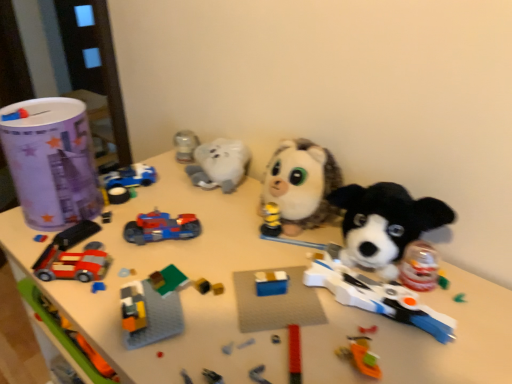
What are the coordinates of `free location to the right of brick-like plastic car at lower left, arranged as the 4th toy when viewed from the right` in the screenshot? It's located at (175, 270).